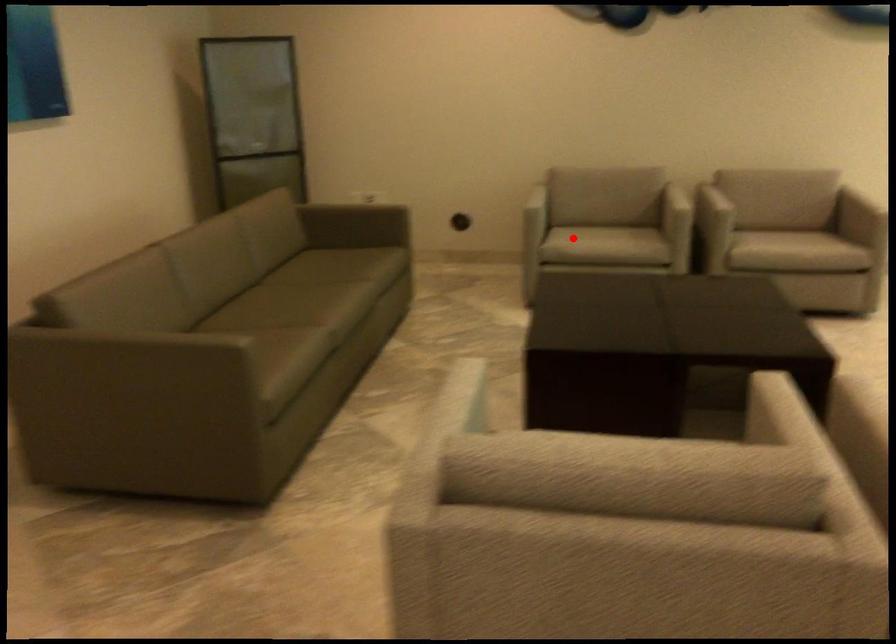
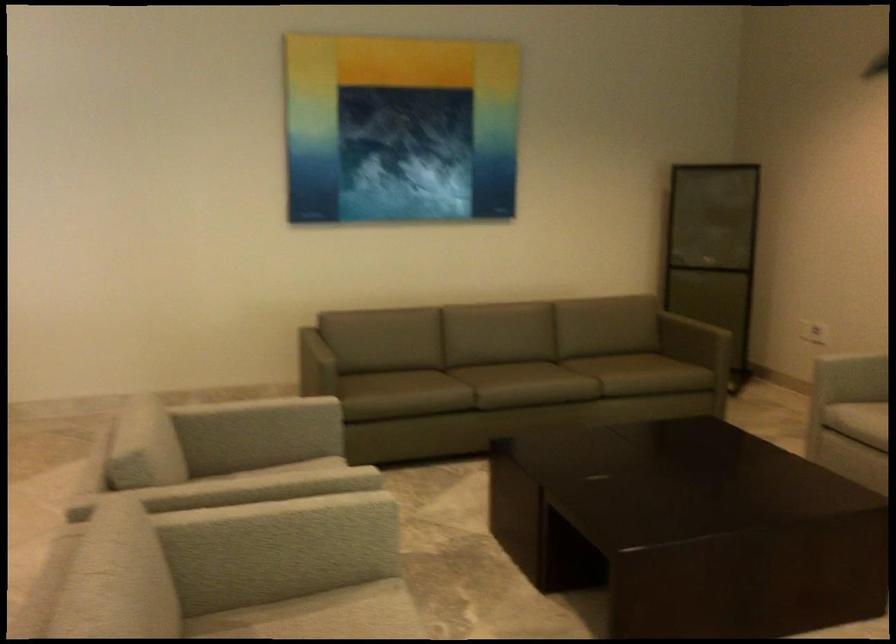
Question: I am providing you with two images of the same scene from different viewpoints. Given a red point in image1, look at the same physical point in image2. Is it:

Choices:
 (A) Closer to the viewpoint
 (B) Farther from the viewpoint

Answer: (A)